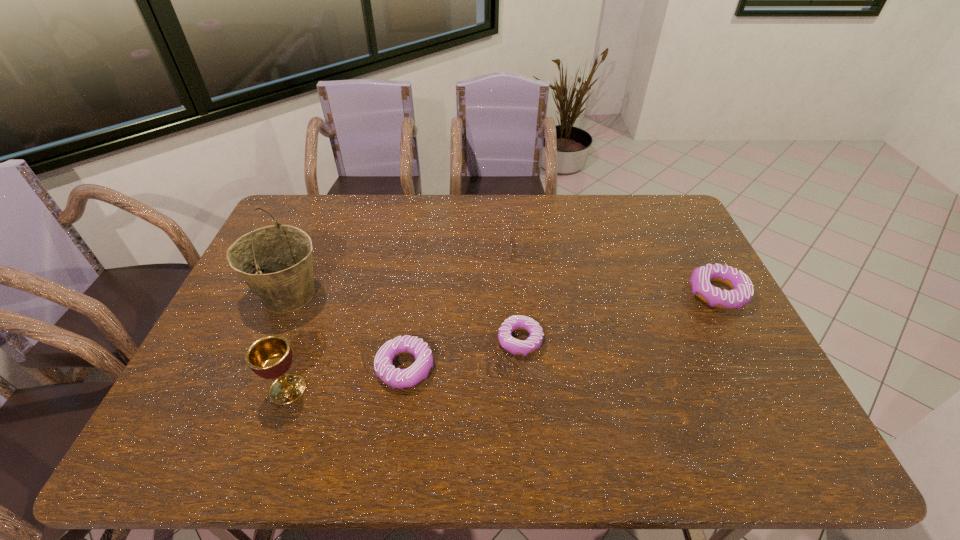
At what (x,y) coordinates should I click in order to perform the action: click on free space between the fourth object from right to left and the rightmost object. Please return your answer as a coordinate pair (x, y). Looking at the image, I should click on (562, 330).

Find the location of a particular element. unoccupied area between the fifth shortest object and the second doughnut from right to left is located at coordinates [x=404, y=365].

This screenshot has width=960, height=540. What are the coordinates of `empty space that is in between the tallest object and the spectacles` in the screenshot? It's located at (408, 273).

At what (x,y) coordinates should I click in order to perform the action: click on vacant space that is in between the tallest object and the spectacles. Please return your answer as a coordinate pair (x, y). This screenshot has width=960, height=540. Looking at the image, I should click on (408, 273).

This screenshot has width=960, height=540. I want to click on free space between the farthest object and the second tallest doughnut, so click(467, 308).

Where is `vacant space that is in between the chalice and the spectacles`? vacant space that is in between the chalice and the spectacles is located at coordinates (408, 319).

This screenshot has height=540, width=960. I want to click on the closest object relative to the leftmost doughnut, so click(270, 357).

Locate which object is the fifth closest to the spectacles. Please provide its 2D coordinates. Your answer should be formatted as a tuple, i.e. [(x, y)], where the tuple contains the x and y coordinates of a point satisfying the conditions above.

[(270, 357)]

Choose which doughnut is the third nearest neighbor to the tallest object. Please provide its 2D coordinates. Your answer should be formatted as a tuple, i.e. [(x, y)], where the tuple contains the x and y coordinates of a point satisfying the conditions above.

[(742, 290)]

Identify the location of doughnut that is the closest one to the rightmost object. The width and height of the screenshot is (960, 540). (514, 346).